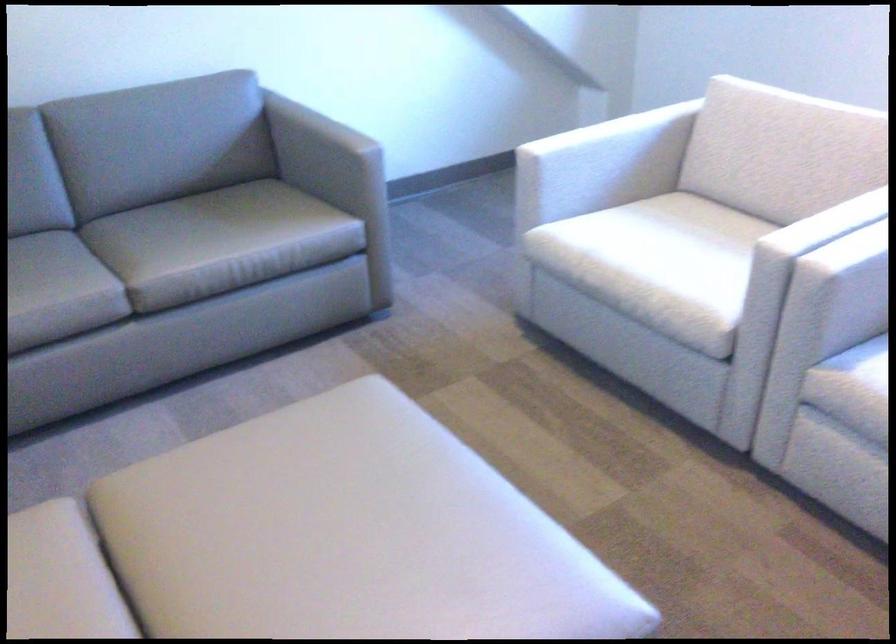
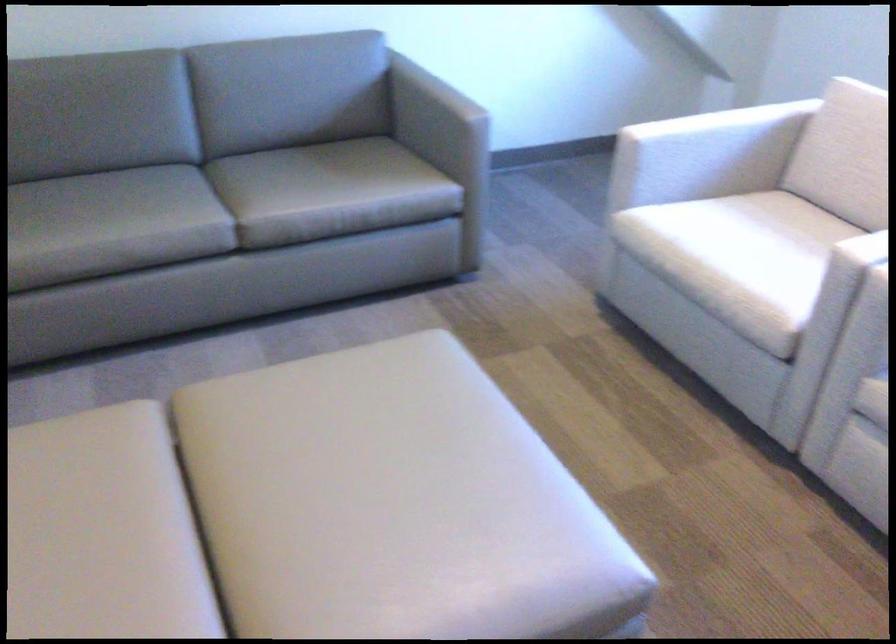
Locate, in the second image, the point that corresponds to point 348,138 in the first image.

(457, 104)